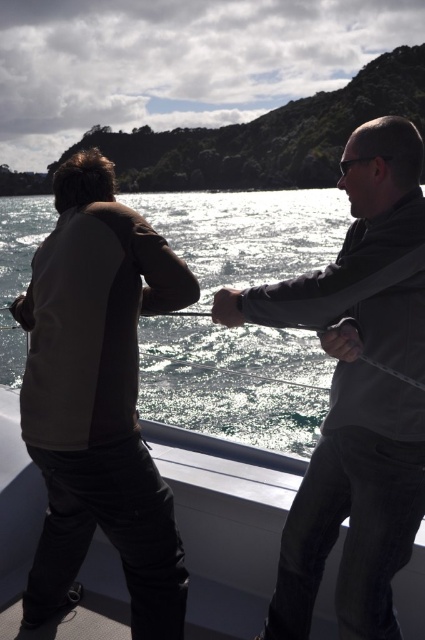
Looking at this image, you are a sailor on a ship that requires you to throw a lifebuoy to someone in the water. The lifebuoy can travel 20 meters. You are standing on the white glossy boat at lower center and see the glistening water at center where the person is. Can you reach them with the lifebuoy?

The distance between the white glossy boat at lower center and the glistening water at center is 21.14 meters. Since the lifebuoy can only travel 20 meters, it cannot reach the person in the glistening water at center.

You are standing on the boat deck and need to retrieve an object located at point (209, 365). If your maximum reach is 15 feet, can you reach it without moving?

The point (209, 365) is 20.25 feet away from the viewer, which exceeds your maximum reach of 15 feet. You cannot reach it without moving.

Looking at this image, you are standing on the deck of a boat and want to reach a point marked as point (399, 422). If your arm can extend 5 feet, can you reach that point without moving?

The distance between you and point (399, 422) is 8.46 feet, which is farther than your arm can reach. You cannot reach it without moving.